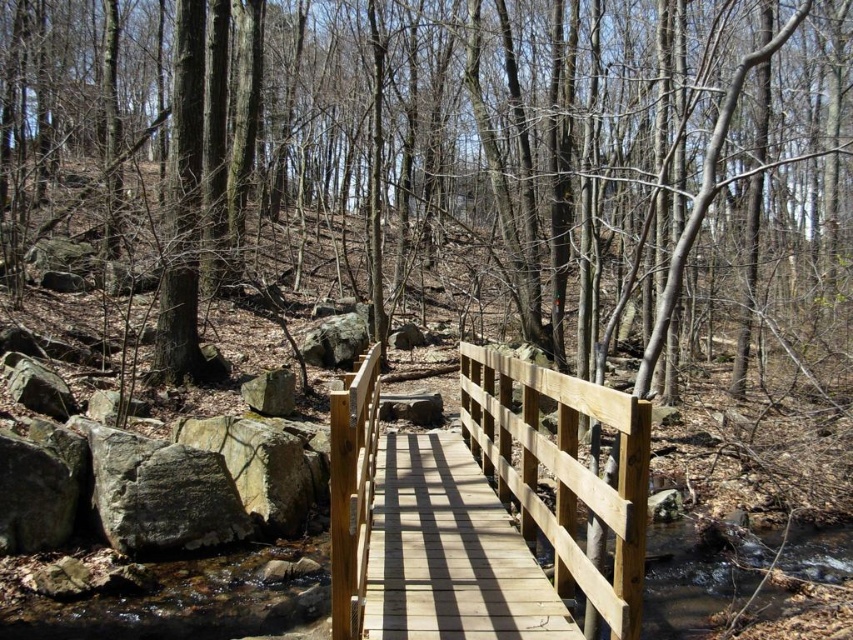
Question: Which point is closer to the camera?

Choices:
 (A) (592, 492)
 (B) (776, 22)

Answer: (A)

Question: From the image, what is the correct spatial relationship of wooden bridge at center in relation to gray rough stone at center-left?

Choices:
 (A) below
 (B) above

Answer: (A)

Question: Is smooth brown wooden bridge at center bigger than wooden bridge at center?

Choices:
 (A) no
 (B) yes

Answer: (B)

Question: Is wooden bridge at center below gray rough stone at center-left?

Choices:
 (A) yes
 (B) no

Answer: (A)

Question: Which is farther from the natural wood bridge at center?

Choices:
 (A) wooden bridge at center
 (B) gray rough stone at center-left

Answer: (B)

Question: Which is farther from the wooden bridge at center?

Choices:
 (A) gray rough stone at center-left
 (B) natural wood bridge at center

Answer: (A)